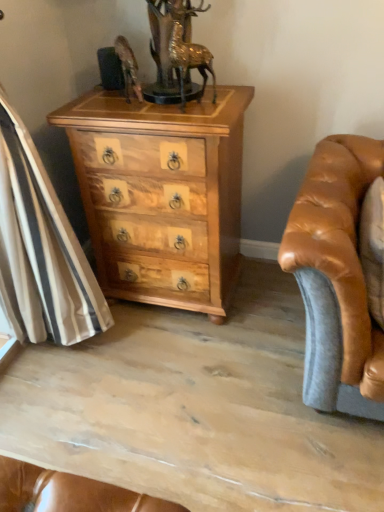
What are the coordinates of `vacant space situated on the left part of gold metallic deer at upper center` in the screenshot? It's located at (150, 111).